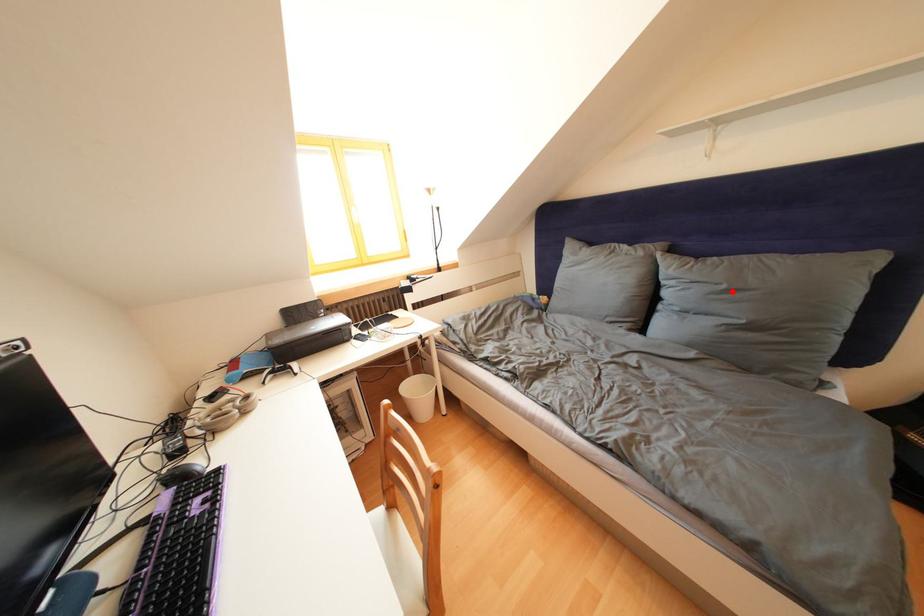
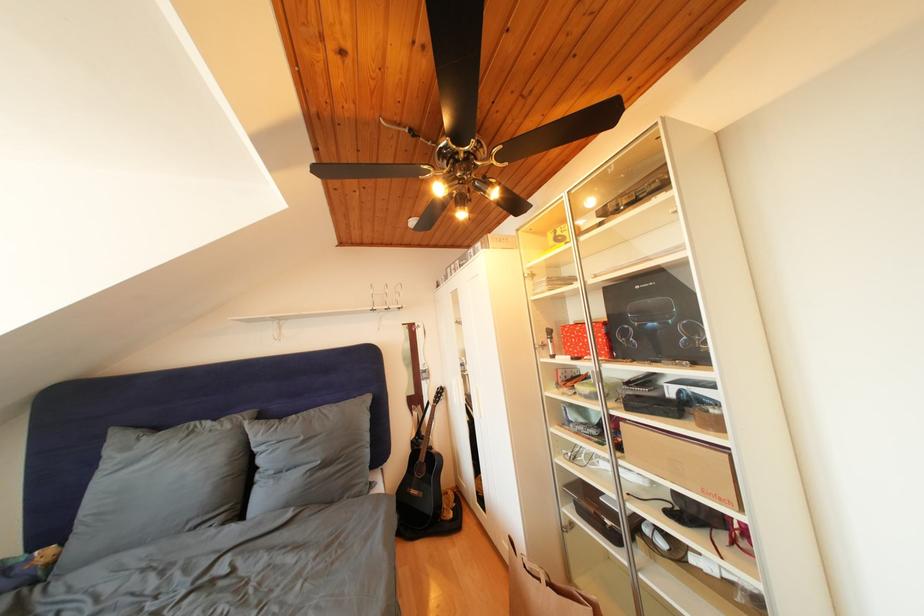
Where in the second image is the point corresponding to the highlighted location from the first image?

(310, 444)